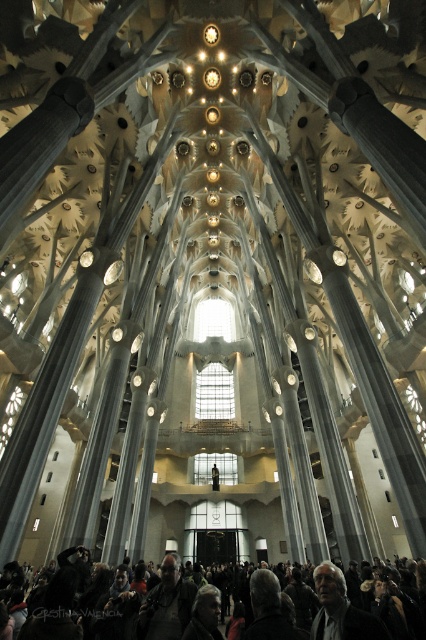
Who is shorter, dark gray fabric crowd at lower center or gray hair at center?

Standing shorter between the two is gray hair at center.

Can you confirm if dark gray fabric crowd at lower center is smaller than gray hair at center?

Incorrect, dark gray fabric crowd at lower center is not smaller in size than gray hair at center.

Is point (408, 636) farther from camera compared to point (319, 576)?

No.

Locate an element on the screen. This screenshot has height=640, width=426. dark gray fabric crowd at lower center is located at coordinates (391, 598).

Consider the image. Is gray hair at center further to camera compared to dark gray jacket at lower center?

No, it is in front of dark gray jacket at lower center.

Which of these two, gray hair at center or dark gray jacket at lower center, stands taller?

Standing taller between the two is dark gray jacket at lower center.

You are a GUI agent. You are given a task and a screenshot of the screen. Output one action in this format:
    pyautogui.click(x=<x>, y=<y>)
    Task: Click on the gray hair at center
    
    Given the screenshot: What is the action you would take?
    pyautogui.click(x=340, y=609)

Can you confirm if dark gray fabric crowd at lower center is taller than dark gray jacket at lower center?

Yes, dark gray fabric crowd at lower center is taller than dark gray jacket at lower center.

Find the location of a particular element. dark gray fabric crowd at lower center is located at coordinates (391, 598).

The height and width of the screenshot is (640, 426). Find the location of `dark gray fabric crowd at lower center`. dark gray fabric crowd at lower center is located at coordinates (391, 598).